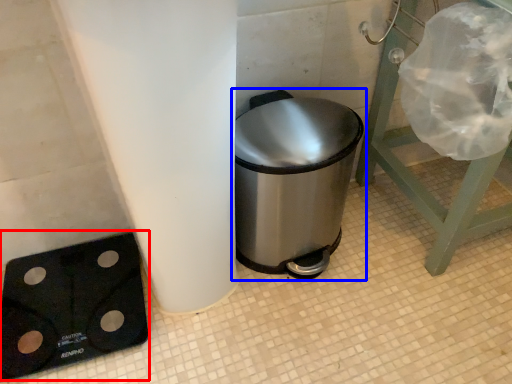
Question: Which of the following is the closest to the observer, weight scale (highlighted by a red box) or waste container (highlighted by a blue box)?

Choices:
 (A) weight scale
 (B) waste container

Answer: (B)